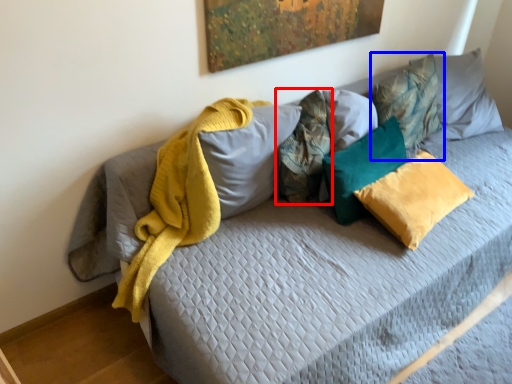
Question: Which object appears farthest to the camera in this image, pillow (highlighted by a red box) or pillow (highlighted by a blue box)?

Choices:
 (A) pillow
 (B) pillow

Answer: (B)